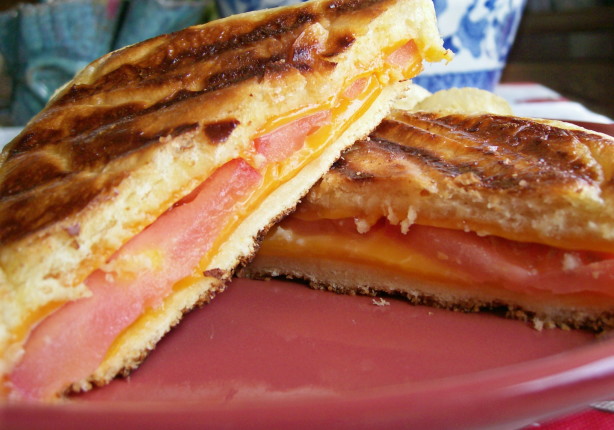
At what (x,y) coordinates should I click in order to perform the action: click on round pink plate. Please return your answer as a coordinate pair (x, y). Looking at the image, I should click on point(382,412).